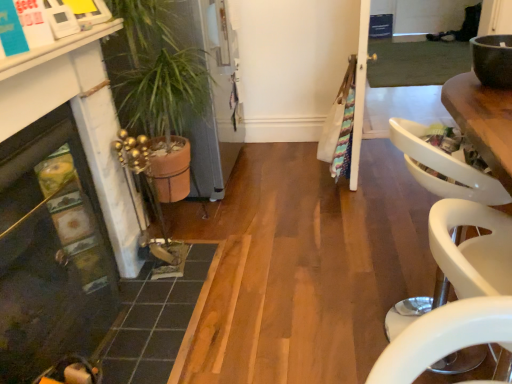
Question: Can you confirm if dark gray tile at lower left is thinner than white plastic armchair at right?

Choices:
 (A) no
 (B) yes

Answer: (A)

Question: Is dark gray tile at lower left smaller than white plastic armchair at right?

Choices:
 (A) no
 (B) yes

Answer: (B)

Question: Considering the relative positions of dark gray tile at lower left and white plastic armchair at right in the image provided, is dark gray tile at lower left to the right of white plastic armchair at right from the viewer's perspective?

Choices:
 (A) no
 (B) yes

Answer: (A)

Question: Is dark gray tile at lower left surrounding white plastic armchair at right?

Choices:
 (A) no
 (B) yes

Answer: (A)

Question: Is dark gray tile at lower left oriented towards white plastic armchair at right?

Choices:
 (A) yes
 (B) no

Answer: (B)

Question: Does dark gray tile at lower left have a greater height compared to white plastic armchair at right?

Choices:
 (A) yes
 (B) no

Answer: (B)

Question: From a real-world perspective, is matte brown bowl at upper right positioned under dark gray tile at lower left based on gravity?

Choices:
 (A) yes
 (B) no

Answer: (B)

Question: Is matte brown bowl at upper right turned away from dark gray tile at lower left?

Choices:
 (A) yes
 (B) no

Answer: (B)

Question: Is matte brown bowl at upper right bigger than dark gray tile at lower left?

Choices:
 (A) no
 (B) yes

Answer: (A)

Question: Considering the relative sizes of matte brown bowl at upper right and dark gray tile at lower left in the image provided, is matte brown bowl at upper right taller than dark gray tile at lower left?

Choices:
 (A) no
 (B) yes

Answer: (B)

Question: From the image's perspective, is matte brown bowl at upper right over dark gray tile at lower left?

Choices:
 (A) no
 (B) yes

Answer: (B)

Question: Is matte brown bowl at upper right positioned in front of dark gray tile at lower left?

Choices:
 (A) yes
 (B) no

Answer: (A)

Question: Does matte black fireplace at lower left lie in front of matte brown bowl at upper right?

Choices:
 (A) no
 (B) yes

Answer: (B)